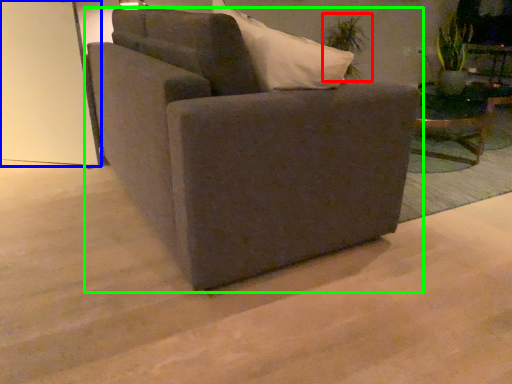
Question: Estimate the real-world distances between objects in this image. Which object is farther from plant (highlighted by a red box), glass door (highlighted by a blue box) or chair (highlighted by a green box)?

Choices:
 (A) glass door
 (B) chair

Answer: (B)